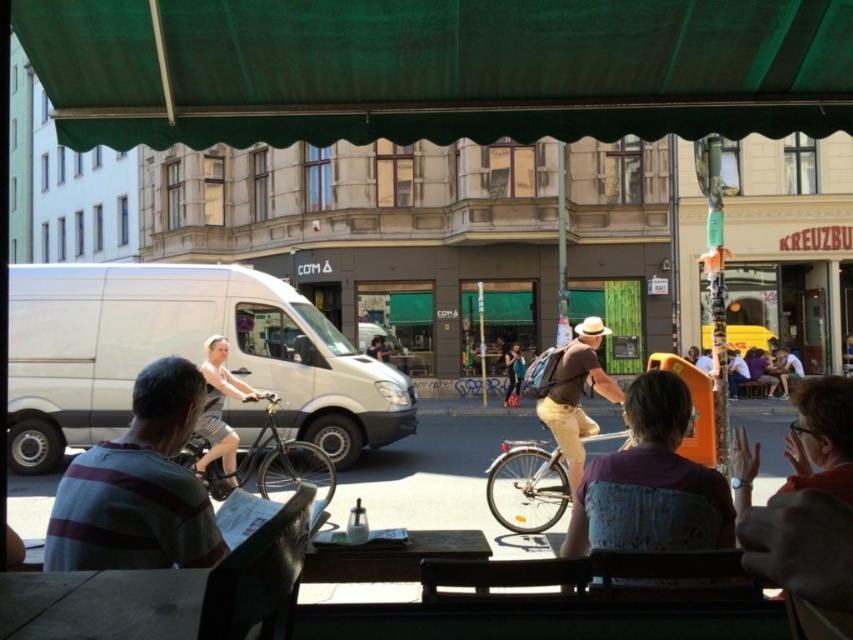
You are a delivery person needing to cross the street safely. You see the brown fabric shirt at center and the shiny silver bicycle at center. Which object is closer to you, and how far apart are they?

The brown fabric shirt at center is 6.42 meters away from the shiny silver bicycle at center. Since both are at the same distance from you, they are equally close.

You are sitting at a table in the shaded area of the outdoor cafe. You notice a person wearing a brown fabric shirt at center. Based on their position in the image, can you determine if they are facing towards the street or away from it?

The brown fabric shirt at center is located at point (651, 483), which places them facing towards the street activity beyond the shaded seating area.